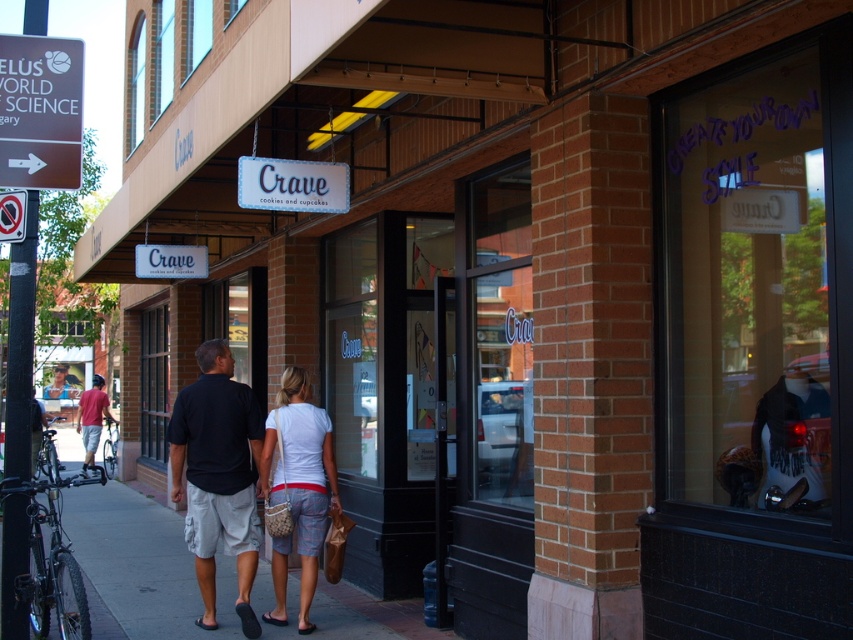
Image resolution: width=853 pixels, height=640 pixels. What do you see at coordinates (39, 112) in the screenshot?
I see `brushed metal sign at upper left` at bounding box center [39, 112].

Can you confirm if brushed metal sign at upper left is positioned above white woven purse at center?

Yes.

The width and height of the screenshot is (853, 640). I want to click on brushed metal sign at upper left, so click(39, 112).

Who is shorter, black cotton shirt at center or brushed metal sign at upper left?

brushed metal sign at upper left is shorter.

Which is above, black cotton shirt at center or brushed metal sign at upper left?

brushed metal sign at upper left

Find the location of `black cotton shirt at center`. black cotton shirt at center is located at coordinates (218, 476).

Is black cotton shirt at center taller than white woven purse at center?

Yes.

Where is `black cotton shirt at center`? The height and width of the screenshot is (640, 853). black cotton shirt at center is located at coordinates (218, 476).

This screenshot has height=640, width=853. I want to click on black cotton shirt at center, so click(x=218, y=476).